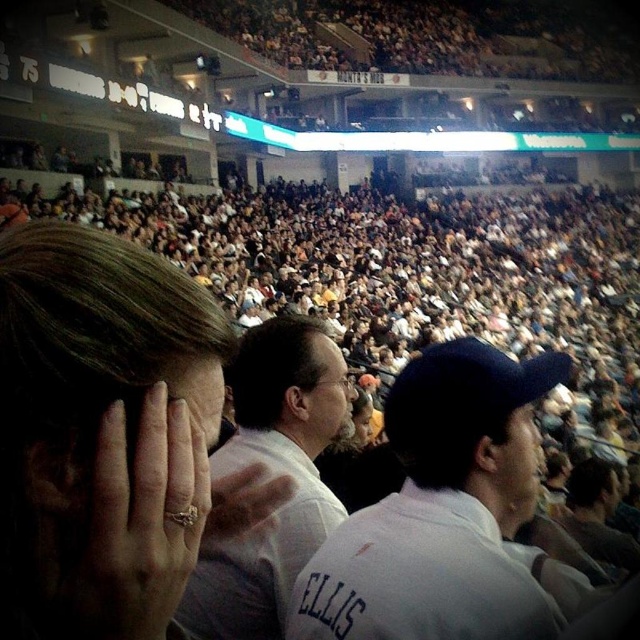
Question: Considering the relative positions of matte gold ring at center and matte white cap at center in the image provided, where is matte gold ring at center located with respect to matte white cap at center?

Choices:
 (A) above
 (B) below

Answer: (A)

Question: Among these points, which one is nearest to the camera?

Choices:
 (A) (508, 513)
 (B) (264, 388)
 (C) (188, 378)

Answer: (C)

Question: Does matte gold ring at center lie in front of matte white cap at center?

Choices:
 (A) yes
 (B) no

Answer: (A)

Question: Which of the following is the closest to the observer?

Choices:
 (A) white cotton shirt at center
 (B) matte white cap at center

Answer: (A)

Question: Which object is the farthest from the matte white face at center?

Choices:
 (A) white cotton shirt at center
 (B) white shirt at center

Answer: (A)

Question: Considering the relative positions of matte gold ring at center and white cotton shirt at center in the image provided, where is matte gold ring at center located with respect to white cotton shirt at center?

Choices:
 (A) right
 (B) left

Answer: (B)